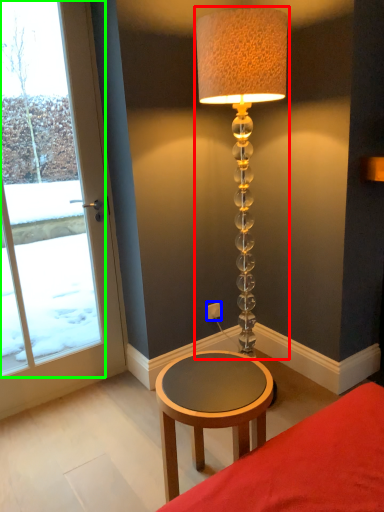
Question: Which object is the closest to the lamp (highlighted by a red box)? Choose among these: electric outlet (highlighted by a blue box) or window (highlighted by a green box).

Choices:
 (A) electric outlet
 (B) window

Answer: (A)